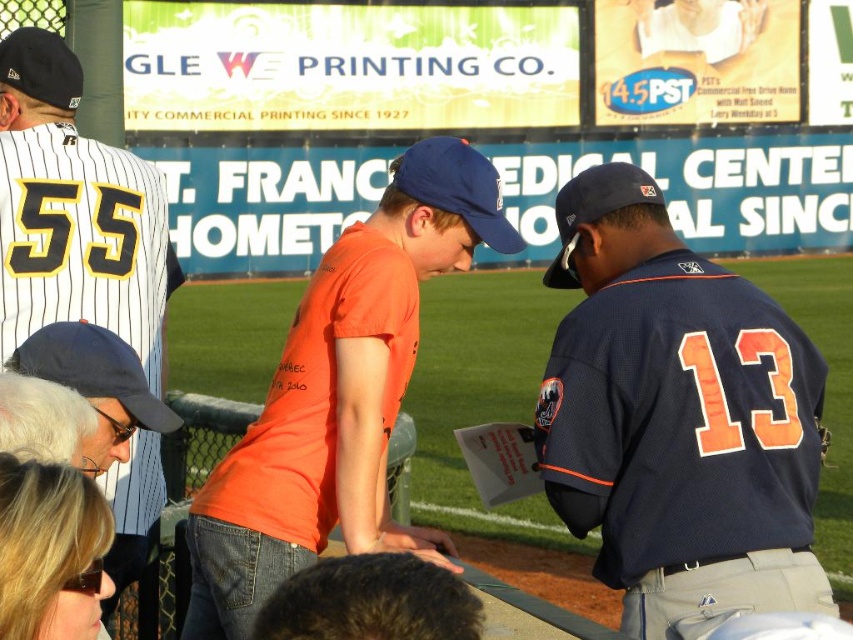
You are a photographer trying to capture a candid shot of the white pinstriped jersey at left without the blue fabric baseball cap at lower left blocking the view. Based on their positions, can you position yourself so that the cap doesn not obstruct the jersey?

The blue fabric baseball cap at lower left is behind the white pinstriped jersey at left, so if you position yourself in front of the jersey, the cap will be behind it and not block the view.

You are a vendor at the baseball stadium and need to place two caps on a display shelf. The navy blue baseball cap at center and the matte black baseball cap at upper left. Which cap should you place on the left side of the shelf to ensure they fit side by side without overlapping?

The navy blue baseball cap at center is wider than the matte black baseball cap at upper left. To fit them side by side without overlapping, place the wider navy blue baseball cap at center on the left side so there is enough space for the narrower matte black baseball cap at upper left on the right.